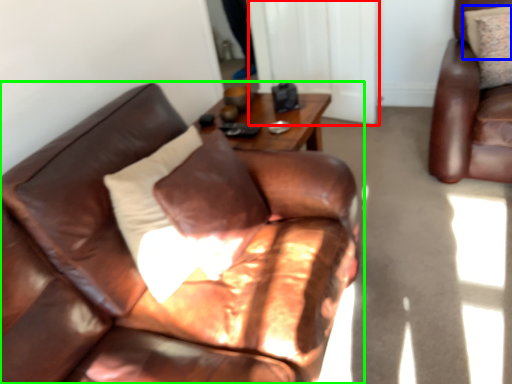
Question: Based on their relative distances, which object is nearer to glass door (highlighted by a red box)? Choose from pillow (highlighted by a blue box) and studio couch (highlighted by a green box).

Choices:
 (A) pillow
 (B) studio couch

Answer: (A)